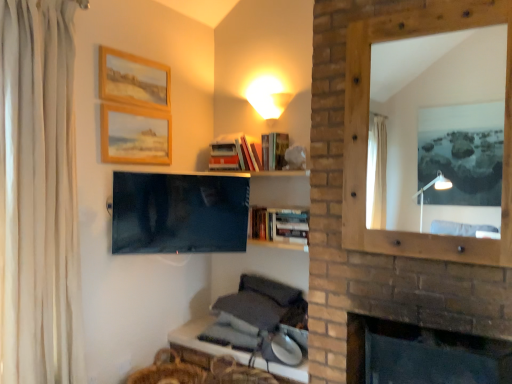
Question: From the image's perspective, relative to hardcover books at upper center, positioned as the first book in top-to-bottom order, is white fabric curtain at left above or below?

Choices:
 (A) above
 (B) below

Answer: (B)

Question: Considering the positions of white fabric curtain at left and hardcover books at upper center, which is the 4th book from bottom to top, in the image, is white fabric curtain at left wider or thinner than hardcover books at upper center, which is the 4th book from bottom to top,?

Choices:
 (A) thin
 (B) wide

Answer: (B)

Question: Which object is positioned farthest from the matte white cone at upper center?

Choices:
 (A) white fabric curtain at left
 (B) hardcover books at upper center, which is the 4th book from bottom to top
 (C) hardcover books at upper center, which appears as the 2th book when ordered from the bottom
 (D) dark brick fireplace at lower right
 (E) wooden table at lower center

Answer: (D)

Question: Estimate the real-world distances between objects in this image. Which object is farther from the wooden picture frame at upper left, which appears as the first picture frame when viewed from the top?

Choices:
 (A) hardcover books at upper center, positioned as the first book in top-to-bottom order
 (B) hardcover books at upper center, which appears as the 2th book when ordered from the bottom
 (C) matte black tv at center
 (D) matte white cone at upper center
 (E) dark brick fireplace at lower right

Answer: (E)